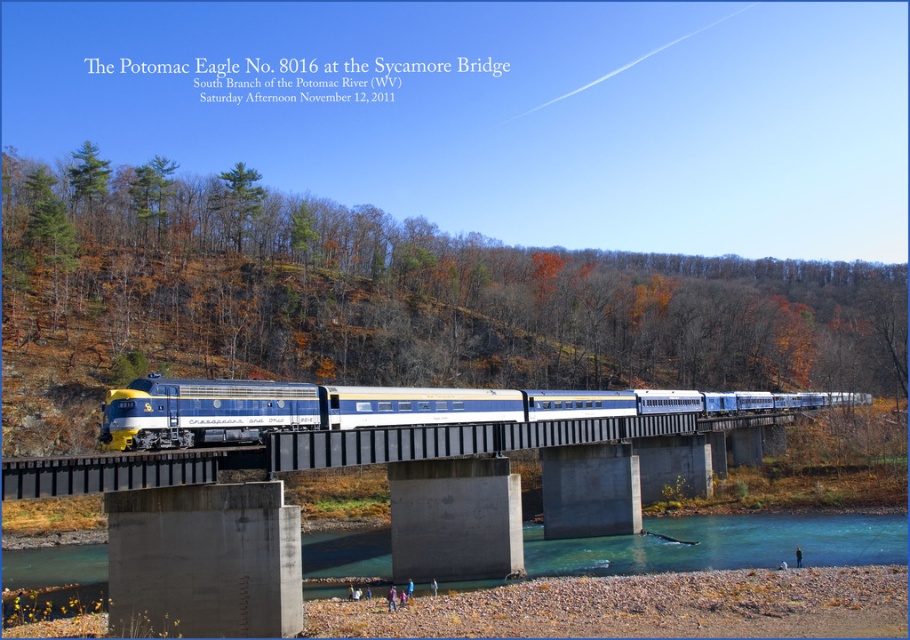
Is blue polished metal train at center to the left of concrete bridge at center from the viewer's perspective?

No, blue polished metal train at center is not to the left of concrete bridge at center.

From the picture: Is blue polished metal train at center wider than concrete bridge at center?

Yes.

Between point (224, 385) and point (263, 451), which one is positioned behind?

The point (224, 385) is more distant.

The height and width of the screenshot is (640, 910). Identify the location of blue polished metal train at center. (395, 406).